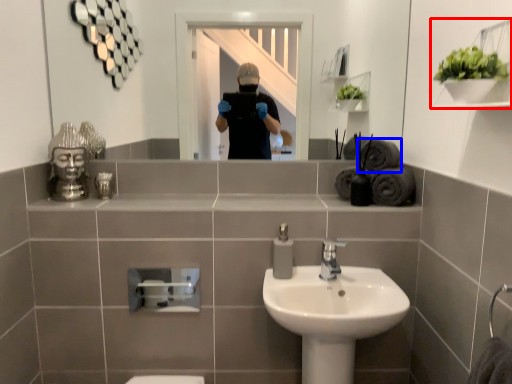
Question: Which point is closer to the camera, shelf (highlighted by a red box) or bath towel (highlighted by a blue box)?

Choices:
 (A) shelf
 (B) bath towel

Answer: (A)